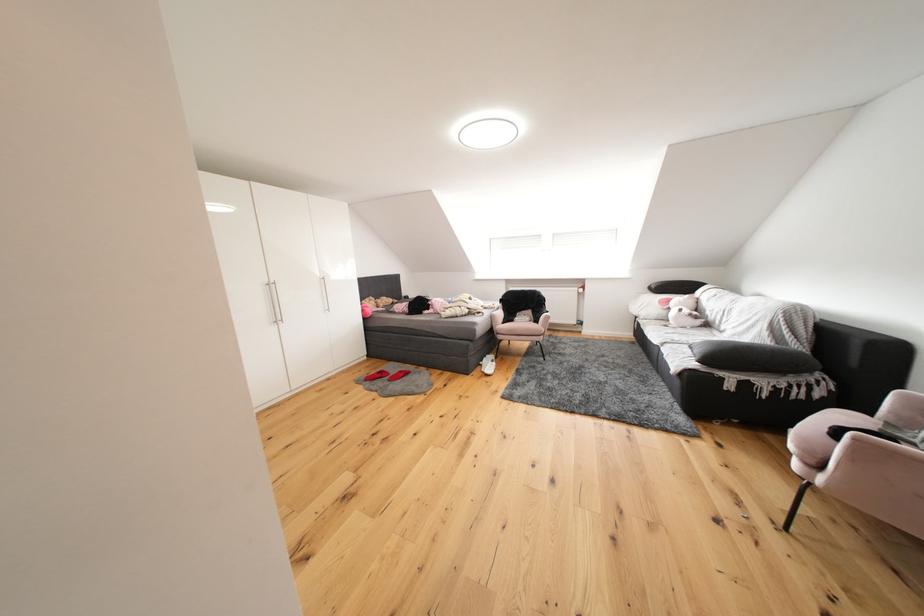
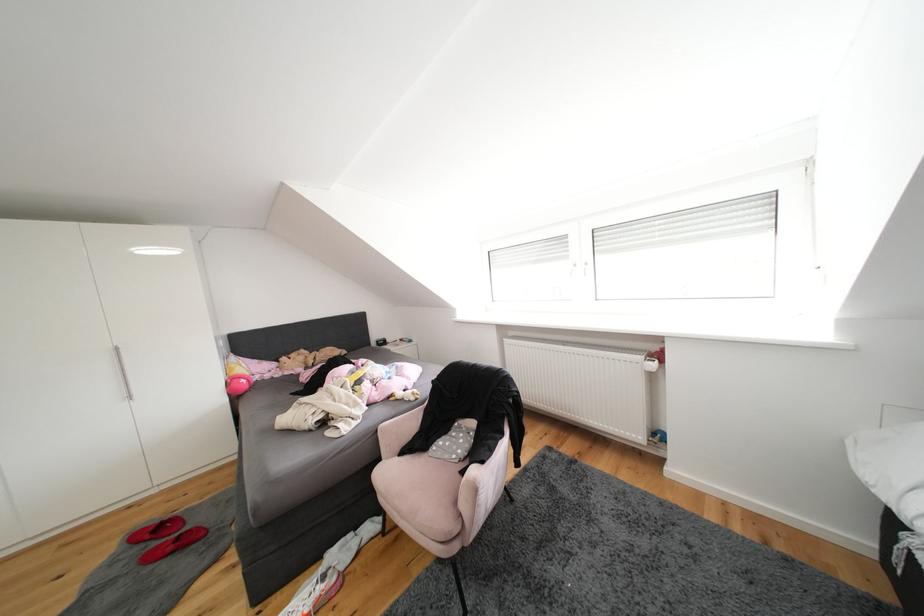
Where in the second image is the point corresponding to the point at 504,368 from the first image?

(331, 592)